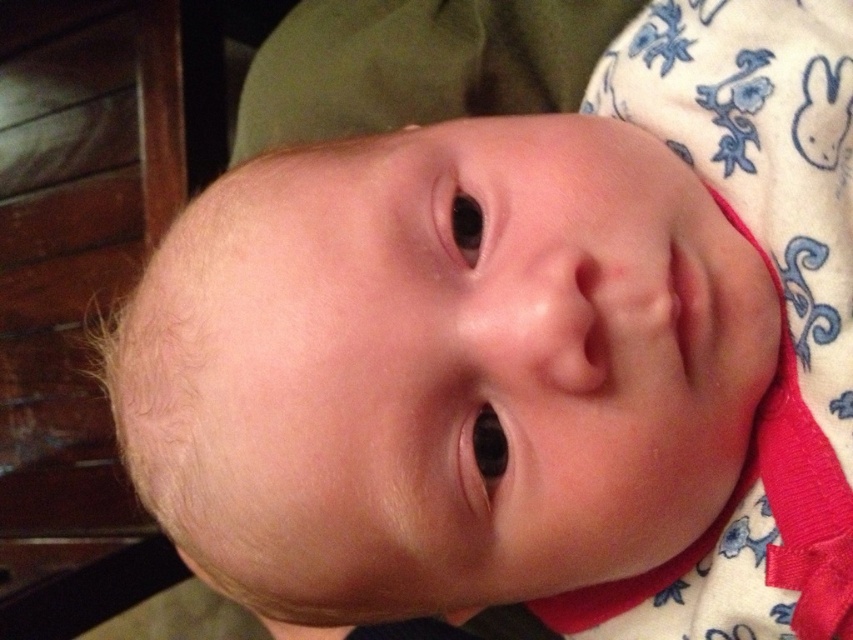
Image resolution: width=853 pixels, height=640 pixels. I want to click on white floral fabric at right, so click(779, 298).

Who is positioned more to the right, white floral fabric at right or pink smooth skin at center?

white floral fabric at right

Locate an element on the screen. white floral fabric at right is located at coordinates (779, 298).

Does white floral fabric at right have a smaller size compared to transparent skin at center?

No, white floral fabric at right is not smaller than transparent skin at center.

Is point (770, 515) farther from viewer compared to point (486, 449)?

Yes, it is behind point (486, 449).

Find the location of a particular element. This screenshot has width=853, height=640. white floral fabric at right is located at coordinates (779, 298).

Who is positioned more to the left, pink smooth skin at center or transparent skin at center?

transparent skin at center

Is pink smooth skin at center smaller than transparent skin at center?

No, pink smooth skin at center is not smaller than transparent skin at center.

Identify the location of pink smooth skin at center. The image size is (853, 640). (688, 307).